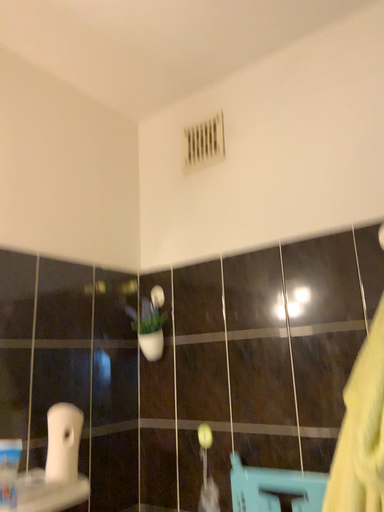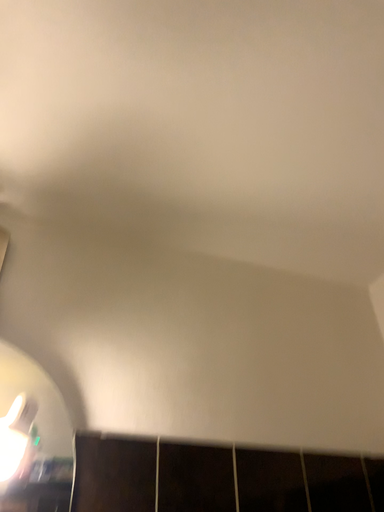
Question: How did the camera likely rotate when shooting the video?

Choices:
 (A) rotated downward
 (B) rotated upward

Answer: (B)